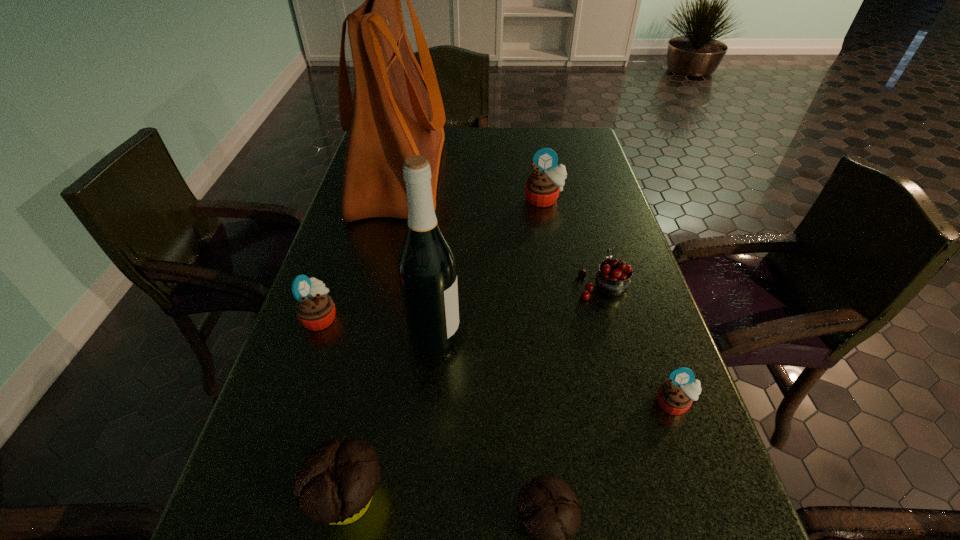
At what (x,y) coordinates should I click in order to perform the action: click on the rightmost muffin. Please return your answer as a coordinate pair (x, y). Looking at the image, I should click on (675, 396).

The image size is (960, 540). I want to click on free spot located 0.250m on the front pocket of the tallest object, so click(x=528, y=176).

The image size is (960, 540). What are the coordinates of `free point located on the label of the dark wine bottle` in the screenshot? It's located at (630, 336).

Find the location of a particular element. The width and height of the screenshot is (960, 540). vacant point located on the front-facing side of the third tallest object is located at coordinates (562, 295).

Find the location of a particular element. This screenshot has width=960, height=540. vacant space located 0.210m on the front-facing side of the leftmost pink muffin is located at coordinates (436, 317).

At what (x,y) coordinates should I click in order to perform the action: click on vacant space located on the handle side of the red cherry. Please return your answer as a coordinate pair (x, y). Looking at the image, I should click on click(x=584, y=222).

I want to click on vacant area located 0.280m on the handle side of the red cherry, so 578,201.

At what (x,y) coordinates should I click in order to perform the action: click on vacant space situated on the handle side of the red cherry. Please return your answer as a coordinate pair (x, y). Image resolution: width=960 pixels, height=540 pixels. Looking at the image, I should click on (575, 191).

This screenshot has height=540, width=960. In order to click on vacant area located 0.170m on the front-facing side of the sixth farthest object in this screenshot , I will do `click(716, 524)`.

The height and width of the screenshot is (540, 960). Find the location of `object at the far edge`. object at the far edge is located at coordinates (396, 112).